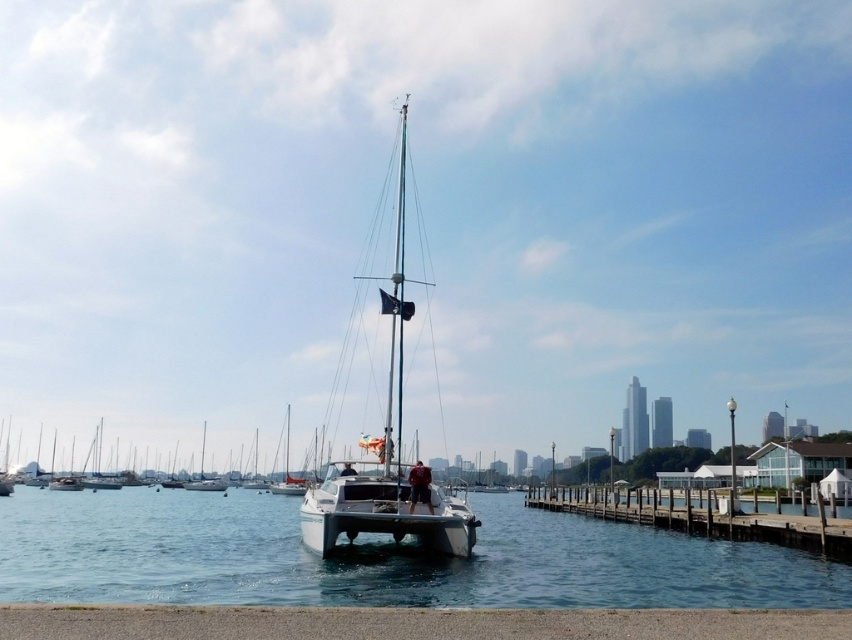
Is clear blue water at center below wooden at right?

Correct, clear blue water at center is located below wooden at right.

Is clear blue water at center to the left of wooden at right from the viewer's perspective?

Correct, you'll find clear blue water at center to the left of wooden at right.

What do you see at coordinates (378, 557) in the screenshot?
I see `clear blue water at center` at bounding box center [378, 557].

Find the location of a particular element. The width and height of the screenshot is (852, 640). clear blue water at center is located at coordinates (378, 557).

Which is more to the left, white glossy sailboat at center or wooden at right?

Positioned to the left is white glossy sailboat at center.

Measure the distance between point (321, 484) and camera.

Point (321, 484) and camera are 18.52 meters apart from each other.

Where is `white glossy sailboat at center`? This screenshot has width=852, height=640. white glossy sailboat at center is located at coordinates (387, 445).

Based on the photo, which is more to the right, clear blue water at center or white glossy sailboat at center?

Positioned to the right is white glossy sailboat at center.

Does clear blue water at center have a smaller size compared to white glossy sailboat at center?

Actually, clear blue water at center might be larger than white glossy sailboat at center.

The height and width of the screenshot is (640, 852). What are the coordinates of `clear blue water at center` in the screenshot? It's located at (378, 557).

Find the location of a particular element. The height and width of the screenshot is (640, 852). clear blue water at center is located at coordinates (378, 557).